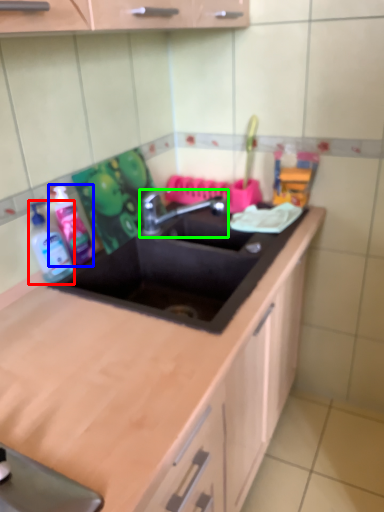
Question: Which object is the farthest from bottle (highlighted by a red box)? Choose among these: cleaning product (highlighted by a blue box) or tap (highlighted by a green box).

Choices:
 (A) cleaning product
 (B) tap

Answer: (B)